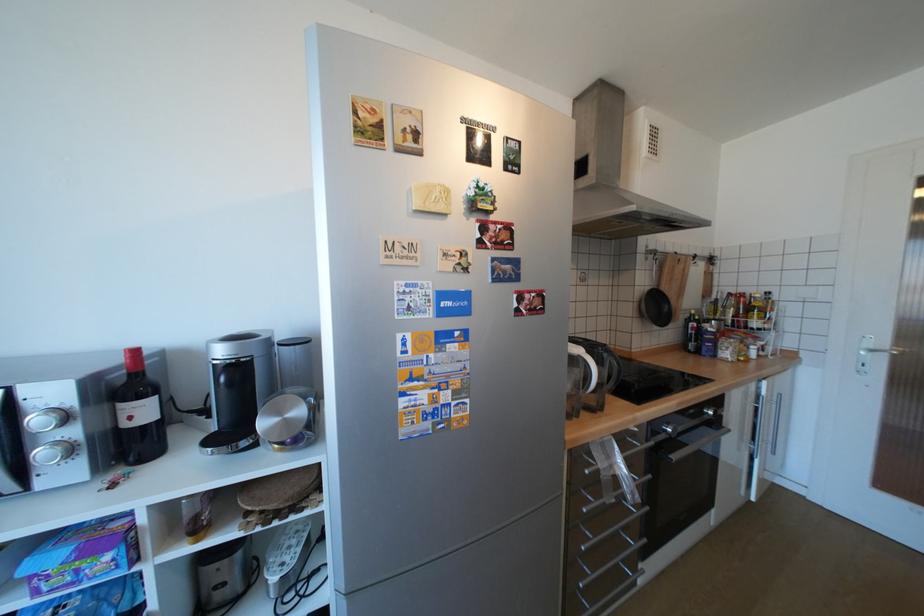
Locate an element on the screen. black kettle handle is located at coordinates (613, 369).